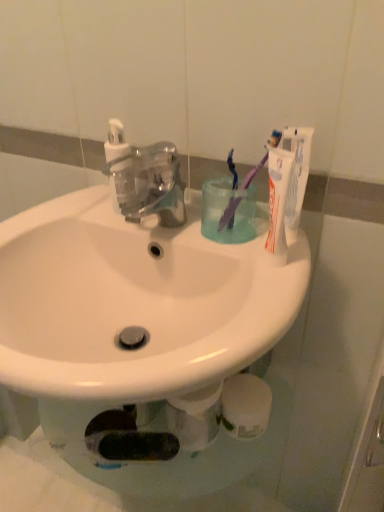
Identify the location of vacant space situated on the left part of white matte toothpaste at upper right. (205, 231).